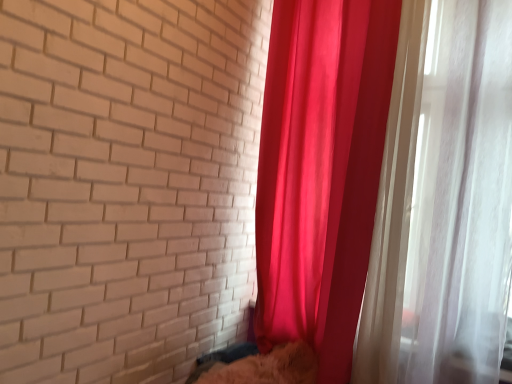
Describe the element at coordinates (385, 191) in the screenshot. I see `silky red curtain at right` at that location.

This screenshot has height=384, width=512. In order to click on silky red curtain at right in this screenshot , I will do `click(385, 191)`.

The image size is (512, 384). I want to click on fuzzy beige cat at lower center, so click(x=263, y=367).

This screenshot has width=512, height=384. What do you see at coordinates (263, 367) in the screenshot?
I see `fuzzy beige cat at lower center` at bounding box center [263, 367].

This screenshot has width=512, height=384. Find the location of `silky red curtain at right`. silky red curtain at right is located at coordinates click(385, 191).

In the scene shown: Is fuzzy beige cat at lower center to the right of silky red curtain at right from the viewer's perspective?

No.

Is fuzzy beige cat at lower center in front of silky red curtain at right?

That is False.

Considering the points (245, 373) and (373, 70), which point is behind, point (245, 373) or point (373, 70)?

Point (373, 70)

From the image's perspective, relative to silky red curtain at right, is fuzzy beige cat at lower center above or below?

Clearly, from the image's perspective, fuzzy beige cat at lower center is below silky red curtain at right.

From a real-world perspective, is fuzzy beige cat at lower center physically above silky red curtain at right?

No, from a real-world perspective, fuzzy beige cat at lower center is not over silky red curtain at right

Which of these two, fuzzy beige cat at lower center or silky red curtain at right, is wider?

With larger width is fuzzy beige cat at lower center.

Considering the relative sizes of fuzzy beige cat at lower center and silky red curtain at right in the image provided, is fuzzy beige cat at lower center shorter than silky red curtain at right?

Yes.

Based on their sizes in the image, would you say fuzzy beige cat at lower center is bigger or smaller than silky red curtain at right?

In the image, fuzzy beige cat at lower center appears to be smaller than silky red curtain at right.

Is fuzzy beige cat at lower center situated inside silky red curtain at right or outside?

fuzzy beige cat at lower center lies outside silky red curtain at right.

Is fuzzy beige cat at lower center far away from silky red curtain at right?

fuzzy beige cat at lower center is actually quite close to silky red curtain at right.

Could you tell me if fuzzy beige cat at lower center is turned towards silky red curtain at right?

No, fuzzy beige cat at lower center is not aimed at silky red curtain at right.

You are a GUI agent. You are given a task and a screenshot of the screen. Output one action in this format:
    pyautogui.click(x=<x>, y=<y>)
    Task: Click on the animal below the silky red curtain at right (from the image's perspective)
    
    Given the screenshot: What is the action you would take?
    [x=263, y=367]

Would you say silky red curtain at right is to the left or to the right of fuzzy beige cat at lower center in the picture?

Clearly, silky red curtain at right is on the right of fuzzy beige cat at lower center in the image.

Is silky red curtain at right in front of or behind fuzzy beige cat at lower center in the image?

silky red curtain at right is in front of fuzzy beige cat at lower center.

Is point (331, 297) farther from camera compared to point (310, 356)?

No, (331, 297) is closer to viewer.

From the image's perspective, which one is positioned higher, silky red curtain at right or fuzzy beige cat at lower center?

silky red curtain at right.

Based on the photo, from a real-world perspective, is silky red curtain at right located higher than fuzzy beige cat at lower center?

Indeed, from a real-world perspective, silky red curtain at right stands above fuzzy beige cat at lower center.

From the picture: Considering the relative sizes of silky red curtain at right and fuzzy beige cat at lower center in the image provided, is silky red curtain at right wider than fuzzy beige cat at lower center?

Incorrect, the width of silky red curtain at right does not surpass that of fuzzy beige cat at lower center.

Considering the relative sizes of silky red curtain at right and fuzzy beige cat at lower center in the image provided, is silky red curtain at right shorter than fuzzy beige cat at lower center?

No.

Considering the sizes of silky red curtain at right and fuzzy beige cat at lower center in the image, is silky red curtain at right bigger or smaller than fuzzy beige cat at lower center?

Clearly, silky red curtain at right is larger in size than fuzzy beige cat at lower center.

Is silky red curtain at right surrounding fuzzy beige cat at lower center?

No, silky red curtain at right does not contain fuzzy beige cat at lower center.

Is silky red curtain at right beside fuzzy beige cat at lower center?

No, silky red curtain at right is not beside fuzzy beige cat at lower center.

Consider the image. Is silky red curtain at right looking in the opposite direction of fuzzy beige cat at lower center?

No, fuzzy beige cat at lower center is not at the back of silky red curtain at right.

Find the location of a particular element. The height and width of the screenshot is (384, 512). animal beneath the silky red curtain at right (from a real-world perspective) is located at coordinates point(263,367).

The image size is (512, 384). Identify the location of animal that is below the silky red curtain at right (from the image's perspective). (263, 367).

This screenshot has height=384, width=512. In order to click on curtain that is above the fuzzy beige cat at lower center (from the image's perspective) in this screenshot , I will do `click(385, 191)`.